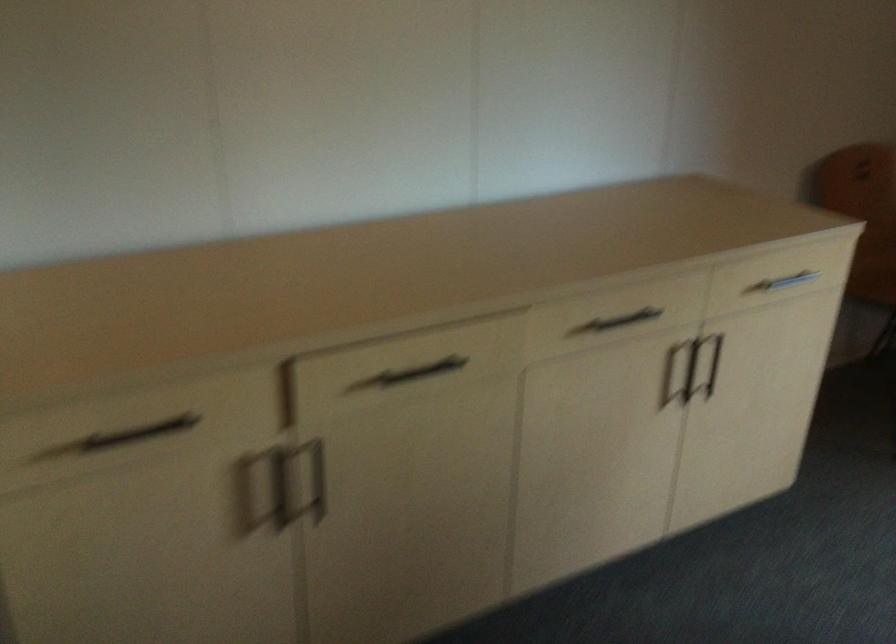
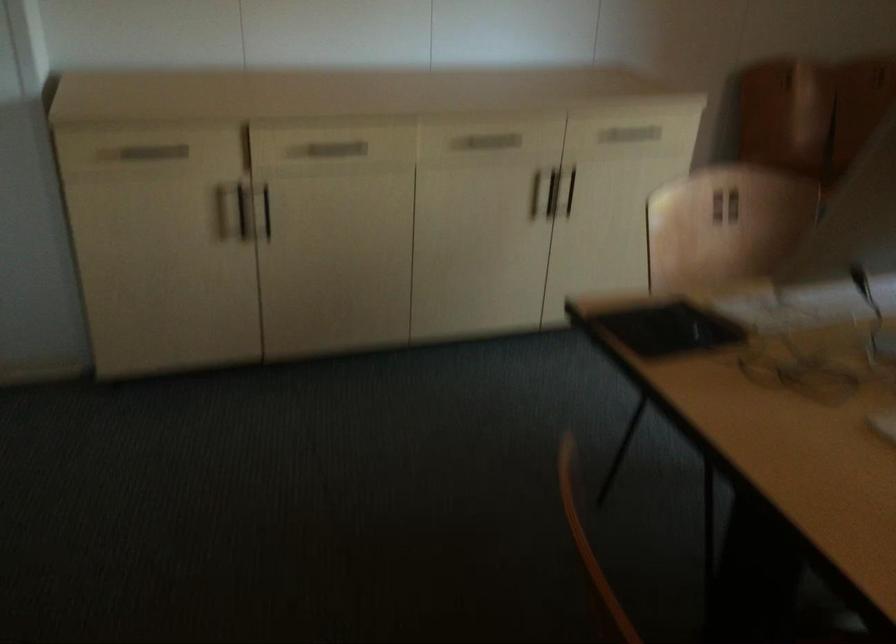
Where in the second image is the point corresponding to pixel 705 364 from the first image?

(570, 192)